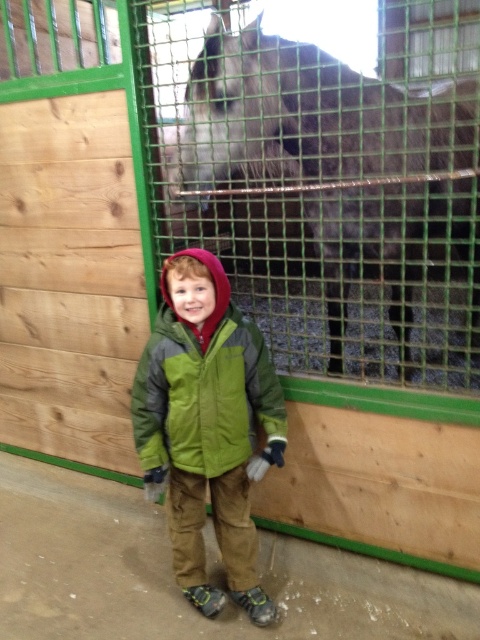
Question: Which of the following is the farthest from the observer?

Choices:
 (A) green fleece jacket at center
 (B) dark brown fur at upper center

Answer: (A)

Question: Can you confirm if dark brown fur at upper center is positioned to the right of green fleece jacket at center?

Choices:
 (A) no
 (B) yes

Answer: (B)

Question: Does dark brown fur at upper center lie in front of green fleece jacket at center?

Choices:
 (A) yes
 (B) no

Answer: (A)

Question: Which object appears closest to the camera in this image?

Choices:
 (A) green fleece jacket at center
 (B) dark brown fur at upper center

Answer: (B)

Question: Does dark brown fur at upper center come in front of green fleece jacket at center?

Choices:
 (A) no
 (B) yes

Answer: (B)

Question: Among these points, which one is nearest to the camera?

Choices:
 (A) (204, 122)
 (B) (277, 440)

Answer: (A)